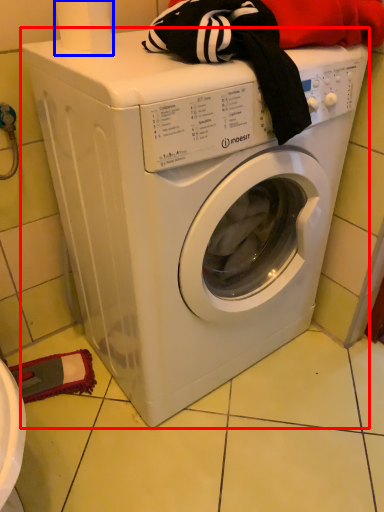
Question: Which point is further to the camera, washing machine (highlighted by a red box) or toilet paper (highlighted by a blue box)?

Choices:
 (A) washing machine
 (B) toilet paper

Answer: (B)